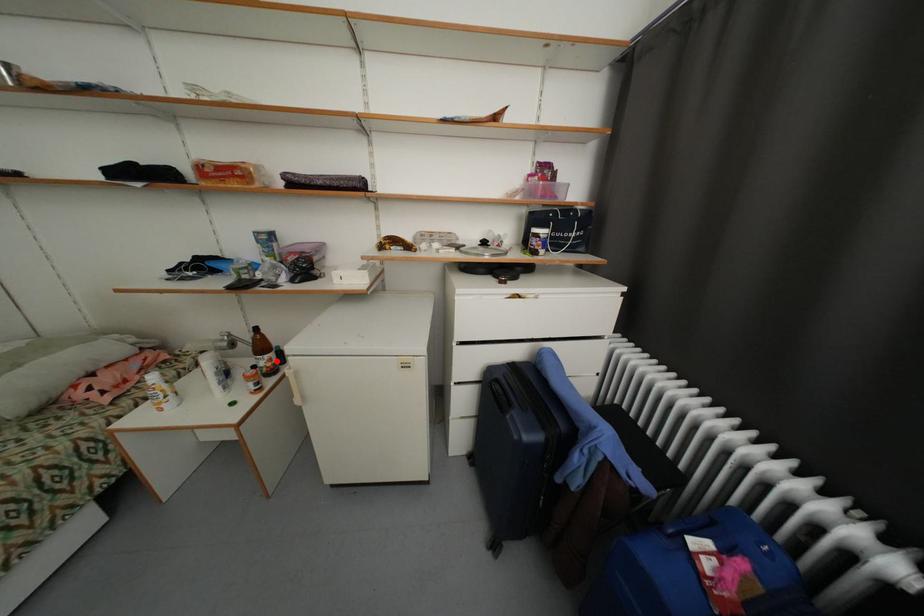
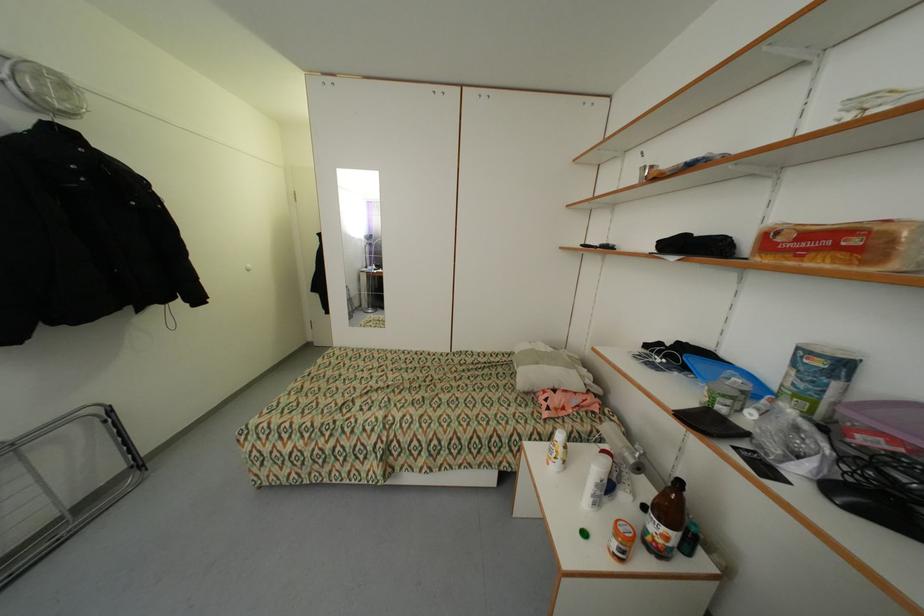
The point at the highlighted location is marked in the first image. Where is the corresponding point in the second image?

(673, 540)